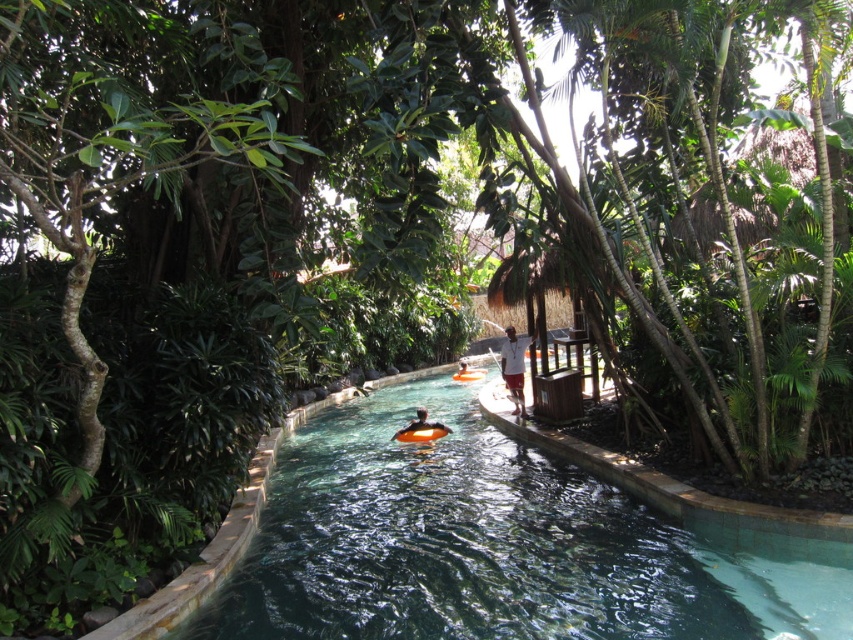
Question: Which point is farther to the camera?

Choices:
 (A) (469, 378)
 (B) (509, 337)
 (C) (733, 634)
 (D) (399, 440)

Answer: (A)

Question: Does white matte shorts at center come in front of orange rubber ring at center?

Choices:
 (A) yes
 (B) no

Answer: (B)

Question: Considering the real-world distances, which object is closest to the orange foam ring at center?

Choices:
 (A) white matte shorts at center
 (B) orange rubber ring at center
 (C) clear blue water at center

Answer: (A)

Question: Does clear blue water at center lie in front of orange rubber ring at center?

Choices:
 (A) no
 (B) yes

Answer: (B)

Question: Can you confirm if orange rubber ring at center is positioned below orange foam ring at center?

Choices:
 (A) yes
 (B) no

Answer: (A)

Question: Among these points, which one is farthest from the camera?

Choices:
 (A) click(560, 545)
 (B) click(502, 364)
 (C) click(479, 372)
 (D) click(410, 428)

Answer: (C)